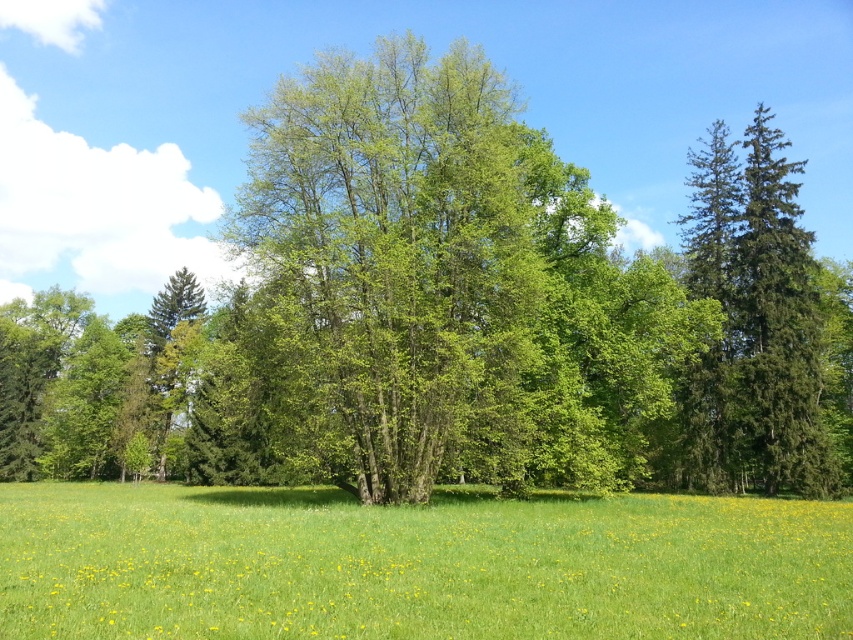
Does point (776, 465) come behind point (514, 573)?

Yes, point (776, 465) is behind point (514, 573).

Who is more distant from viewer, (399,211) or (48,634)?

Point (399,211)

Find the location of a particular element. The width and height of the screenshot is (853, 640). green leafy tree at center is located at coordinates (456, 316).

You are a GUI agent. You are given a task and a screenshot of the screen. Output one action in this format:
    pyautogui.click(x=<x>, y=<y>)
    Task: Click on the green leafy tree at center
    This screenshot has height=640, width=853.
    Given the screenshot: What is the action you would take?
    pyautogui.click(x=456, y=316)